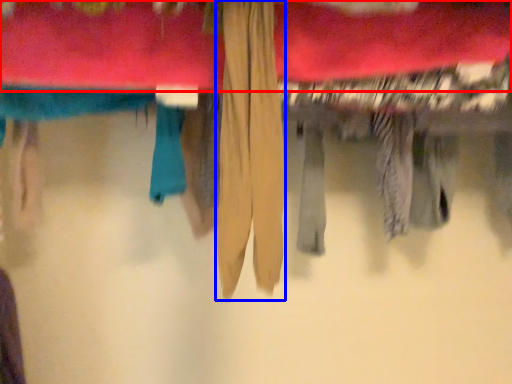
Question: Which object is closer to the camera taking this photo, towel (highlighted by a red box) or clothing (highlighted by a blue box)?

Choices:
 (A) towel
 (B) clothing

Answer: (B)